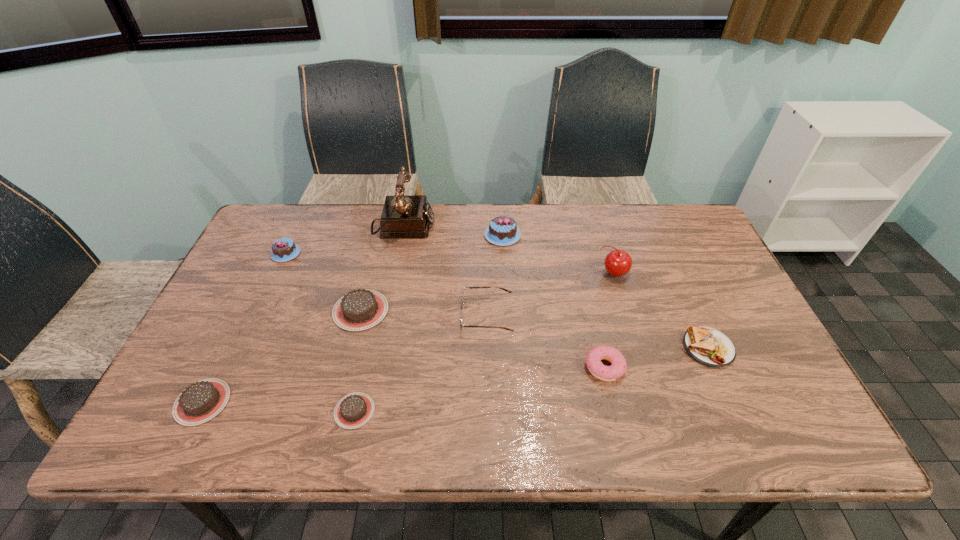
Where is `the biggest brown chocolate cake`? The image size is (960, 540). the biggest brown chocolate cake is located at coordinates (360, 309).

Locate an element on the screen. This screenshot has height=540, width=960. pink doughnut is located at coordinates (593, 360).

Identify the location of sandwich. The width and height of the screenshot is (960, 540). (708, 346).

This screenshot has height=540, width=960. I want to click on beige sandwich, so [x=708, y=346].

Where is `the leftmost brown chocolate cake`? This screenshot has height=540, width=960. the leftmost brown chocolate cake is located at coordinates (201, 401).

This screenshot has height=540, width=960. Find the location of `the fourth tallest chocolate cake`. the fourth tallest chocolate cake is located at coordinates (201, 401).

Locate an element on the screen. the shortest chocolate cake is located at coordinates (354, 410).

At what (x,y) coordinates should I click in order to perform the action: click on the shortest object. Please return your answer as a coordinate pair (x, y). This screenshot has width=960, height=540. Looking at the image, I should click on (354, 410).

What are the coordinates of `vacant space located 0.070m on the dial of the telephone` in the screenshot? It's located at (455, 227).

This screenshot has width=960, height=540. What are the coordinates of `free space located 0.250m on the front of the ninth shortest object` in the screenshot? It's located at (637, 354).